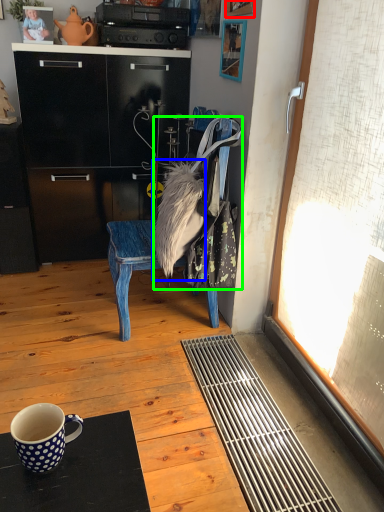
Question: Which object is the closest to the picture frame (highlighted by a red box)? Choose among these: fur (highlighted by a blue box) or handbag (highlighted by a green box).

Choices:
 (A) fur
 (B) handbag

Answer: (B)